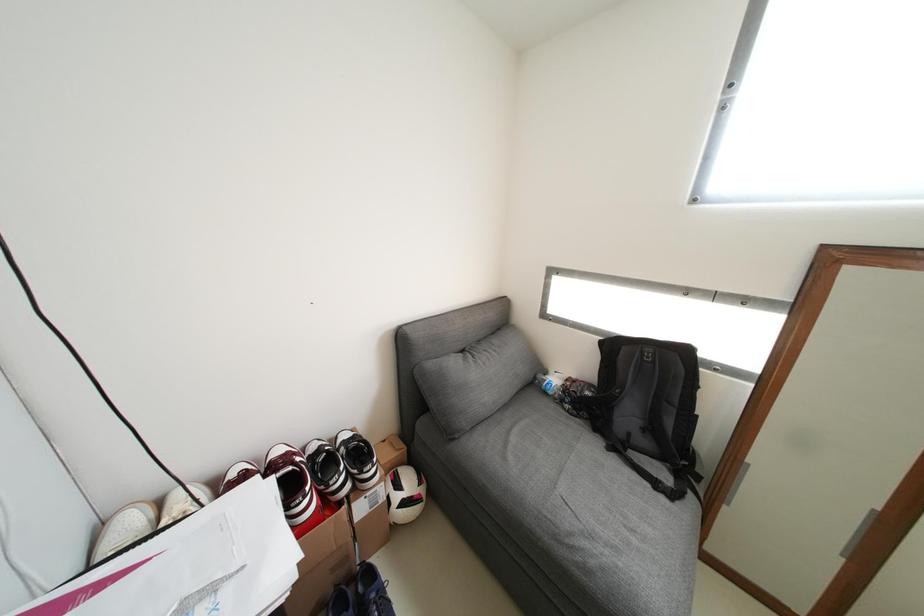
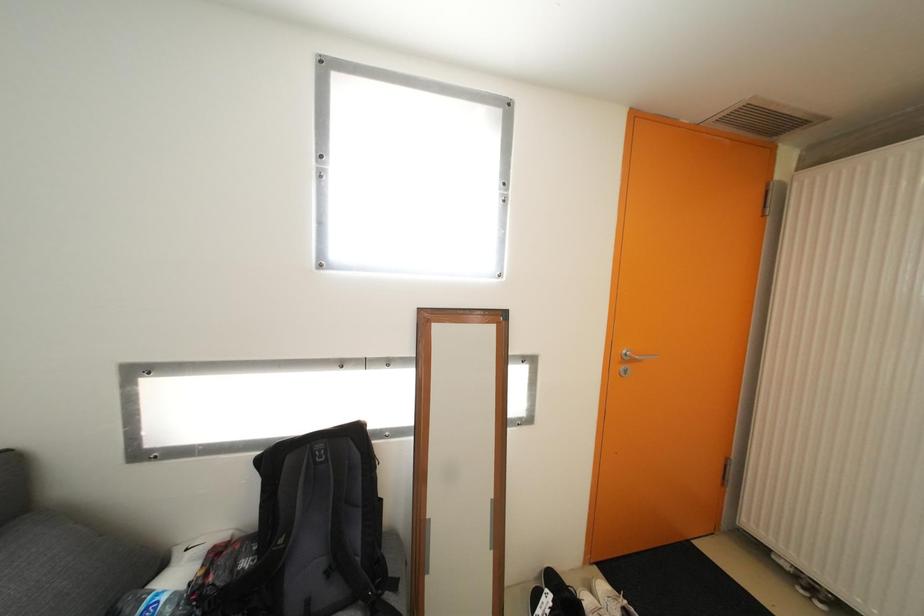
Question: The camera is either moving clockwise (left) or counter-clockwise (right) around the object. The first image is from the beginning of the video and the second image is from the end. Is the camera moving left or right when shooting the video?

Choices:
 (A) Left
 (B) Right

Answer: (A)